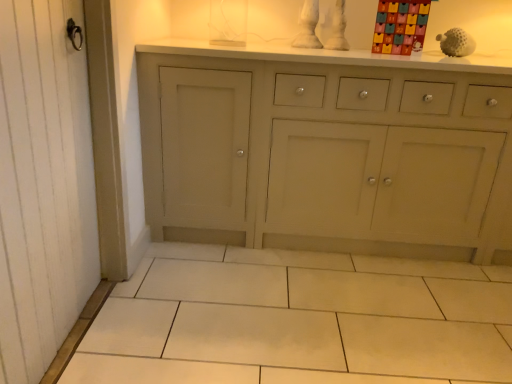
The image size is (512, 384). Describe the element at coordinates (42, 185) in the screenshot. I see `white wood screen door at left` at that location.

You are a GUI agent. You are given a task and a screenshot of the screen. Output one action in this format:
    pyautogui.click(x=<x>, y=<y>)
    Task: Click on the white wood screen door at left
    
    Given the screenshot: What is the action you would take?
    pyautogui.click(x=42, y=185)

What is the approximate height of white matte golf ball at upper right, which is the 1th toy in right-to-left order?

It is 5.59 inches.

Where is `multicolored cardboard advent calendar at upper right, the 1th toy viewed from the left`? Image resolution: width=512 pixels, height=384 pixels. multicolored cardboard advent calendar at upper right, the 1th toy viewed from the left is located at coordinates pos(400,26).

Between white matte golf ball at upper right, acting as the 2th toy starting from the left, and white wood screen door at left, which one has less height?

With less height is white matte golf ball at upper right, acting as the 2th toy starting from the left.

Would you say white matte golf ball at upper right, which is the 1th toy in right-to-left order, is to the left or to the right of white wood screen door at left in the picture?

From the image, it's evident that white matte golf ball at upper right, which is the 1th toy in right-to-left order, is to the right of white wood screen door at left.

Is white matte golf ball at upper right, which is the 1th toy in right-to-left order, spatially inside white wood screen door at left, or outside of it?

white matte golf ball at upper right, which is the 1th toy in right-to-left order, is not inside white wood screen door at left, it's outside.

Could you measure the distance between white matte golf ball at upper right, which is the 1th toy in right-to-left order, and white wood screen door at left?

They are 1.93 meters apart.

Is white matte golf ball at upper right, acting as the 2th toy starting from the left, a part of white wood screen door at left?

That's incorrect, white matte golf ball at upper right, acting as the 2th toy starting from the left, is not inside white wood screen door at left.

In the scene shown: From a real-world perspective, which object stands above the other?

white matte golf ball at upper right, which is the 1th toy in right-to-left order, from a real-world perspective.

From the image's perspective, is white wood screen door at left under white matte golf ball at upper right, which is the 1th toy in right-to-left order?

Yes.

In the scene shown: Is white wood screen door at left facing away from white matte golf ball at upper right, acting as the 2th toy starting from the left?

white wood screen door at left does not have its back to white matte golf ball at upper right, acting as the 2th toy starting from the left.

Measure the distance between multicolored cardboard advent calendar at upper right, the 1th toy viewed from the left, and white matte golf ball at upper right, which is the 1th toy in right-to-left order.

multicolored cardboard advent calendar at upper right, the 1th toy viewed from the left, and white matte golf ball at upper right, which is the 1th toy in right-to-left order, are 14.45 inches apart from each other.

Is multicolored cardboard advent calendar at upper right, marked as the second toy in a right-to-left arrangement, positioned beyond the bounds of white matte golf ball at upper right, acting as the 2th toy starting from the left?

That's correct, multicolored cardboard advent calendar at upper right, marked as the second toy in a right-to-left arrangement, is outside of white matte golf ball at upper right, acting as the 2th toy starting from the left.

Who is shorter, multicolored cardboard advent calendar at upper right, the 1th toy viewed from the left, or white matte golf ball at upper right, which is the 1th toy in right-to-left order?

white matte golf ball at upper right, which is the 1th toy in right-to-left order, is shorter.

Is multicolored cardboard advent calendar at upper right, marked as the second toy in a right-to-left arrangement, thinner than white matte golf ball at upper right, which is the 1th toy in right-to-left order?

Correct, the width of multicolored cardboard advent calendar at upper right, marked as the second toy in a right-to-left arrangement, is less than that of white matte golf ball at upper right, which is the 1th toy in right-to-left order.

Could you tell me if white wood screen door at left is turned towards multicolored cardboard advent calendar at upper right, the 1th toy viewed from the left?

No, white wood screen door at left is not oriented towards multicolored cardboard advent calendar at upper right, the 1th toy viewed from the left.

Could multicolored cardboard advent calendar at upper right, marked as the second toy in a right-to-left arrangement, be considered to be inside white wood screen door at left?

No, multicolored cardboard advent calendar at upper right, marked as the second toy in a right-to-left arrangement, is not surrounded by white wood screen door at left.

Find the location of a particular element. The image size is (512, 384). screen door in front of the multicolored cardboard advent calendar at upper right, marked as the second toy in a right-to-left arrangement is located at coordinates (42, 185).

From the picture: Between white wood screen door at left and multicolored cardboard advent calendar at upper right, the 1th toy viewed from the left, which one has smaller width?

multicolored cardboard advent calendar at upper right, the 1th toy viewed from the left.

Does point (441, 49) lie in front of point (399, 36)?

No, (441, 49) is behind (399, 36).

Is white matte golf ball at upper right, acting as the 2th toy starting from the left, oriented away from multicolored cardboard advent calendar at upper right, the 1th toy viewed from the left?

white matte golf ball at upper right, acting as the 2th toy starting from the left, does not have its back to multicolored cardboard advent calendar at upper right, the 1th toy viewed from the left.

Consider the image. Between white matte golf ball at upper right, which is the 1th toy in right-to-left order, and multicolored cardboard advent calendar at upper right, marked as the second toy in a right-to-left arrangement, which one has more height?

multicolored cardboard advent calendar at upper right, marked as the second toy in a right-to-left arrangement.

From a real-world perspective, which is physically above, white matte golf ball at upper right, acting as the 2th toy starting from the left, or multicolored cardboard advent calendar at upper right, the 1th toy viewed from the left?

multicolored cardboard advent calendar at upper right, the 1th toy viewed from the left, from a real-world perspective.

In the scene shown: How much distance is there between multicolored cardboard advent calendar at upper right, the 1th toy viewed from the left, and white wood screen door at left?

1.48 meters.

Is multicolored cardboard advent calendar at upper right, marked as the second toy in a right-to-left arrangement, positioned before white wood screen door at left?

No, the depth of multicolored cardboard advent calendar at upper right, marked as the second toy in a right-to-left arrangement, is greater than that of white wood screen door at left.

Would you say multicolored cardboard advent calendar at upper right, the 1th toy viewed from the left, is outside white wood screen door at left?

Absolutely, multicolored cardboard advent calendar at upper right, the 1th toy viewed from the left, is external to white wood screen door at left.

From the image's perspective, is multicolored cardboard advent calendar at upper right, the 1th toy viewed from the left, above or below white wood screen door at left?

Based on their image positions, multicolored cardboard advent calendar at upper right, the 1th toy viewed from the left, is located above white wood screen door at left.

Which toy is the 2nd one when counting from the right side of the white wood screen door at left? Please provide its 2D coordinates.

[(456, 43)]

Locate an element on the screen. This screenshot has height=384, width=512. screen door located below the white matte golf ball at upper right, acting as the 2th toy starting from the left (from the image's perspective) is located at coordinates (42, 185).

When comparing their distances from white wood screen door at left, does white matte golf ball at upper right, acting as the 2th toy starting from the left, or multicolored cardboard advent calendar at upper right, marked as the second toy in a right-to-left arrangement, seem further?

Among the two, white matte golf ball at upper right, acting as the 2th toy starting from the left, is located further to white wood screen door at left.

Looking at the image, which one is located further to white wood screen door at left, multicolored cardboard advent calendar at upper right, marked as the second toy in a right-to-left arrangement, or white matte golf ball at upper right, acting as the 2th toy starting from the left?

Based on the image, white matte golf ball at upper right, acting as the 2th toy starting from the left, appears to be further to white wood screen door at left.

Based on their spatial positions, is white wood screen door at left or white matte golf ball at upper right, which is the 1th toy in right-to-left order, further from multicolored cardboard advent calendar at upper right, the 1th toy viewed from the left?

Among the two, white wood screen door at left is located further to multicolored cardboard advent calendar at upper right, the 1th toy viewed from the left.

From the image, which object appears to be nearer to multicolored cardboard advent calendar at upper right, marked as the second toy in a right-to-left arrangement, white matte golf ball at upper right, acting as the 2th toy starting from the left, or white wood screen door at left?

white matte golf ball at upper right, acting as the 2th toy starting from the left, is positioned closer to the anchor multicolored cardboard advent calendar at upper right, marked as the second toy in a right-to-left arrangement.

Considering their positions, is multicolored cardboard advent calendar at upper right, marked as the second toy in a right-to-left arrangement, positioned further to white matte golf ball at upper right, which is the 1th toy in right-to-left order, than white wood screen door at left?

Among the two, white wood screen door at left is located further to white matte golf ball at upper right, which is the 1th toy in right-to-left order.

Looking at the image, which one is located closer to white matte golf ball at upper right, which is the 1th toy in right-to-left order, white wood screen door at left or multicolored cardboard advent calendar at upper right, marked as the second toy in a right-to-left arrangement?

Based on the image, multicolored cardboard advent calendar at upper right, marked as the second toy in a right-to-left arrangement, appears to be nearer to white matte golf ball at upper right, which is the 1th toy in right-to-left order.

The width and height of the screenshot is (512, 384). What are the coordinates of `toy between white wood screen door at left and white matte golf ball at upper right, acting as the 2th toy starting from the left` in the screenshot? It's located at (400, 26).